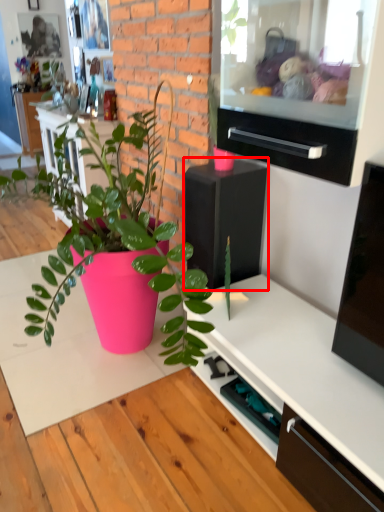
Question: From the image's perspective, where is appliance (annotated by the red box) located in relation to drawer in the image?

Choices:
 (A) above
 (B) below

Answer: (B)